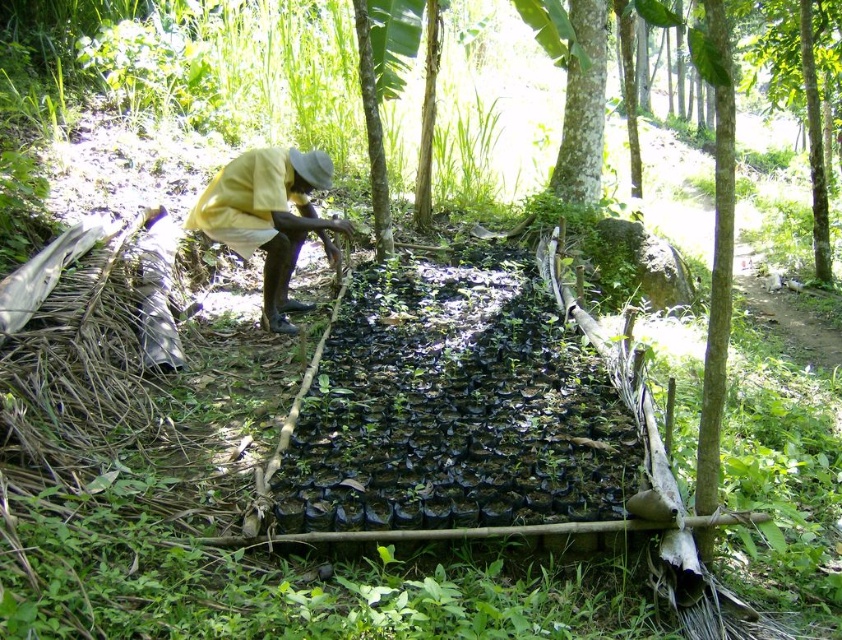
Can you confirm if yellow fabric at center is bigger than green rough bark tree at upper center?

No, yellow fabric at center is not bigger than green rough bark tree at upper center.

Who is taller, yellow fabric at center or green rough bark tree at upper center?

green rough bark tree at upper center

Does point (308, 304) lie in front of point (605, 44)?

That is True.

At what (x,y) coordinates should I click in order to perform the action: click on yellow fabric at center. Please return your answer as a coordinate pair (x, y). Looking at the image, I should click on (269, 218).